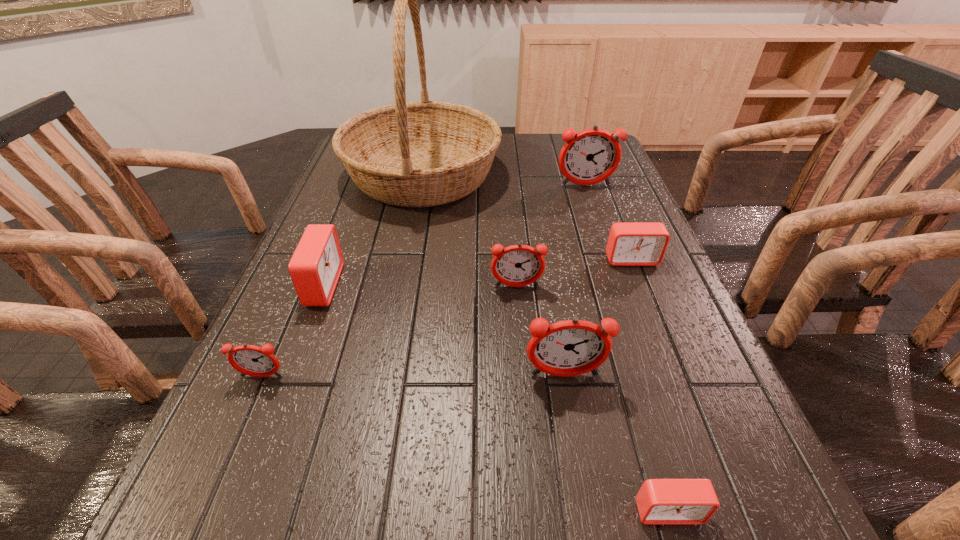
Identify which red alarm clock is located as the nearest to the leftmost red alarm clock. Please provide its 2D coordinates. Your answer should be formatted as a tuple, i.e. [(x, y)], where the tuple contains the x and y coordinates of a point satisfying the conditions above.

[(629, 244)]

Identify the location of free space that satisfies the following two spatial constraints: 1. on the front side of the tallest object; 2. on the front-facing side of the biggest red alarm clock. (400, 286).

Where is `vacant space that satisfies the following two spatial constraints: 1. on the front-facing side of the tallest alarm clock; 2. on the front-facing side of the leftmost red alarm clock`? The width and height of the screenshot is (960, 540). vacant space that satisfies the following two spatial constraints: 1. on the front-facing side of the tallest alarm clock; 2. on the front-facing side of the leftmost red alarm clock is located at coordinates (620, 286).